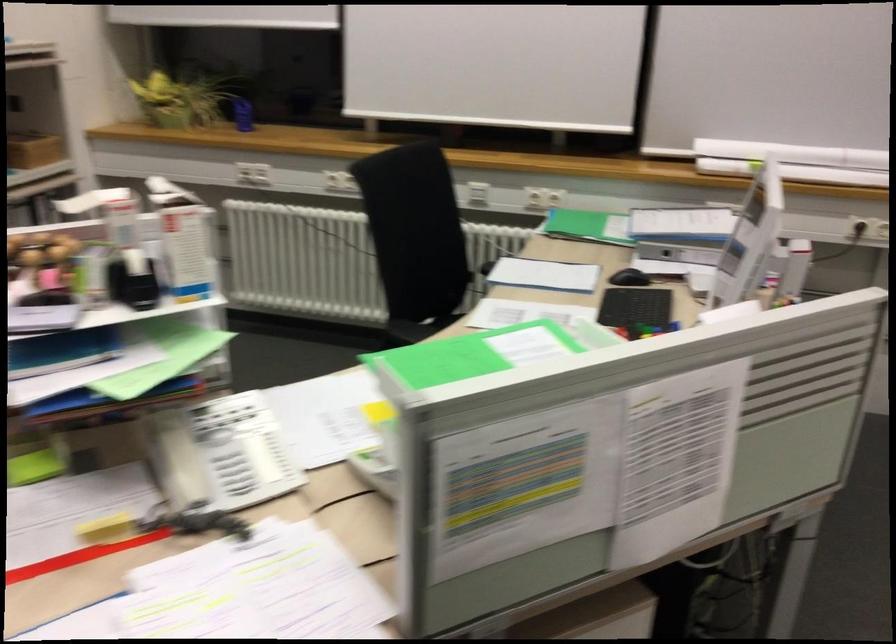
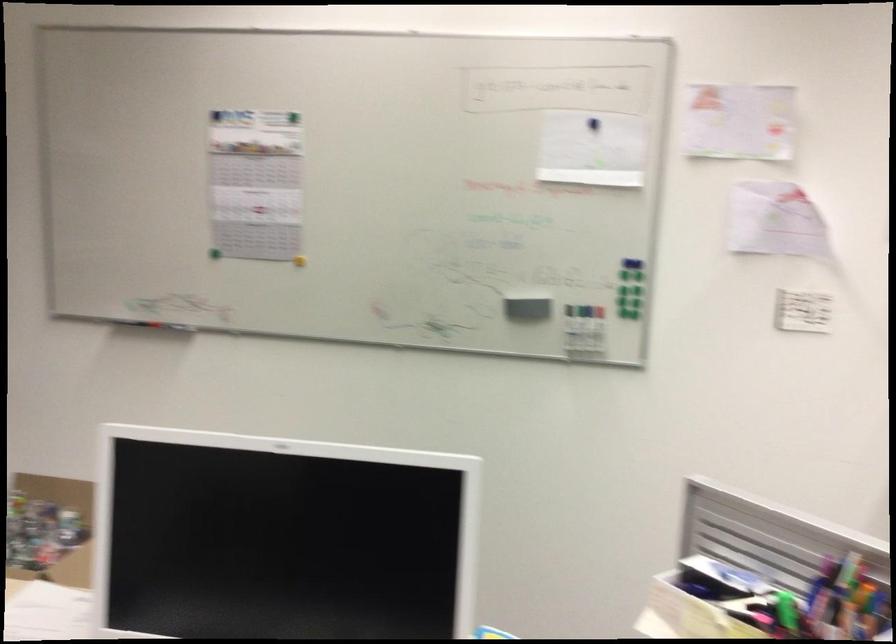
Question: Based on the continuous images, in which direction is the camera rotating? Reply with the corresponding letter.

Choices:
 (A) Left
 (B) Right
 (C) Up
 (D) Down

Answer: (A)